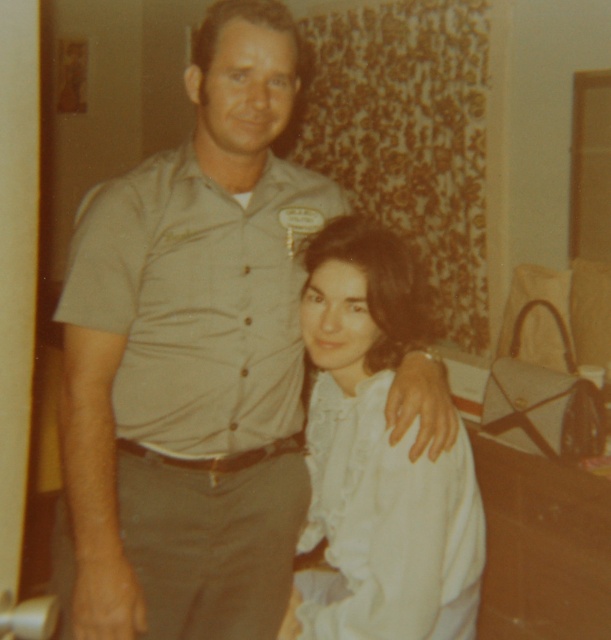
You are a photographer trying to determine the best way to frame a group shot of the matte khaki shirt at center and the white ruffled blouse at center. Based on their current positions, which one should you adjust to be on the left side of the frame?

The matte khaki shirt at center is already positioned on the left side of the white ruffled blouse at center, so there is no need to adjust its position. It is already on the left side of the frame.

Based on the photo, you are a photographer setting up a photo shoot. You need to adjust the lighting to ensure both the matte khaki shirt at center and the white ruffled blouse at center are well illuminated. Considering their sizes, which clothing item might require more focused lighting adjustments?

The matte khaki shirt at center is much taller than the white ruffled blouse at center, so it might require more focused lighting adjustments to ensure proper illumination due to its larger size.

You are a photographer adjusting the camera focus. The matte khaki shirt at center and the white ruffled blouse at center are both in the frame. Which one is closer to the camera?

The matte khaki shirt at center is 22.94 centimeters away from the white ruffled blouse at center, so the matte khaki shirt at center is closer to the camera than the white ruffled blouse at center.